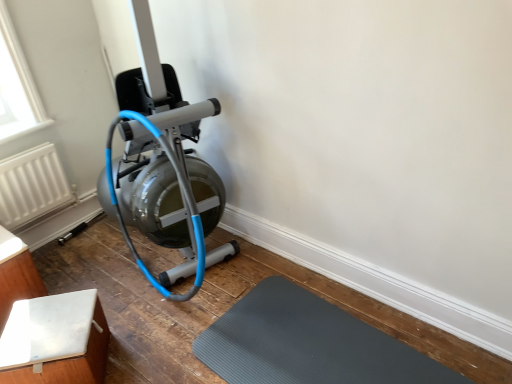
Where is `free space above white matte table at lower left, the 2th furniture viewed from the left (from a real-world perspective)`? This screenshot has width=512, height=384. free space above white matte table at lower left, the 2th furniture viewed from the left (from a real-world perspective) is located at coordinates click(x=40, y=339).